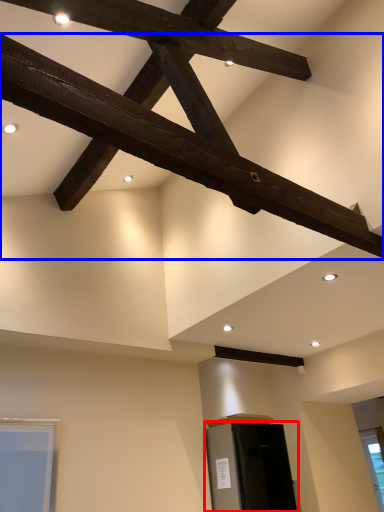
Question: Which object is further to the camera taking this photo, furniture (highlighted by a red box) or beam (highlighted by a blue box)?

Choices:
 (A) furniture
 (B) beam

Answer: (A)